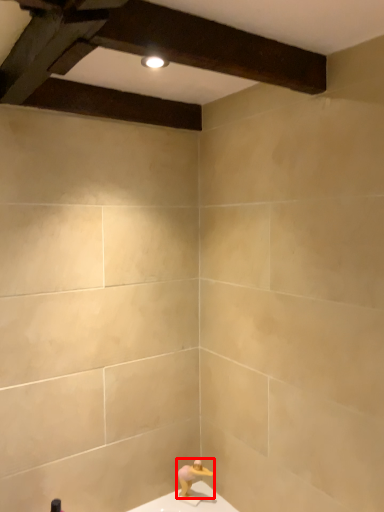
Question: From the image, what is the correct spatial relationship of person (annotated by the red box) in relation to plank?

Choices:
 (A) left
 (B) right

Answer: (B)